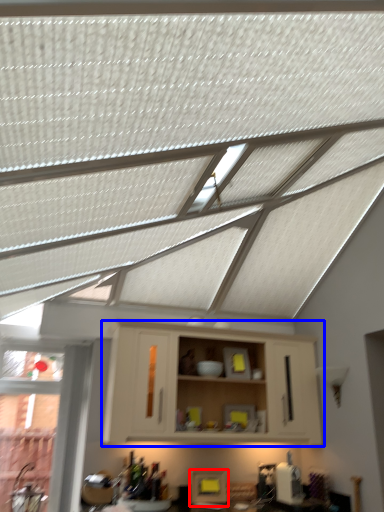
Question: Which object appears closest to the camera in this image, appliance (highlighted by a red box) or cabinetry (highlighted by a blue box)?

Choices:
 (A) appliance
 (B) cabinetry

Answer: (B)